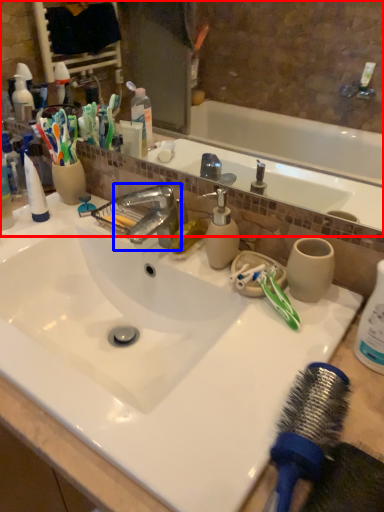
Question: Which object appears closest to the camera in this image, mirror (highlighted by a red box) or tap (highlighted by a blue box)?

Choices:
 (A) mirror
 (B) tap

Answer: (A)